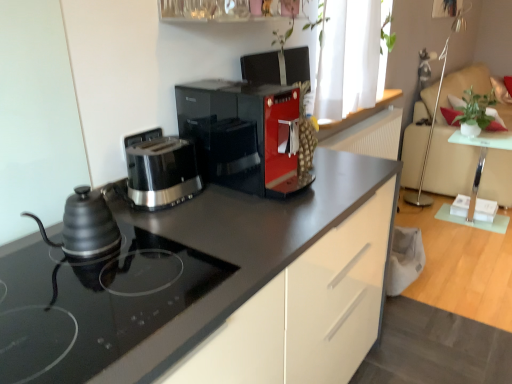
Find the location of a particular element. This screenshot has width=512, height=384. free space in front of matte black kettle at left is located at coordinates (72, 288).